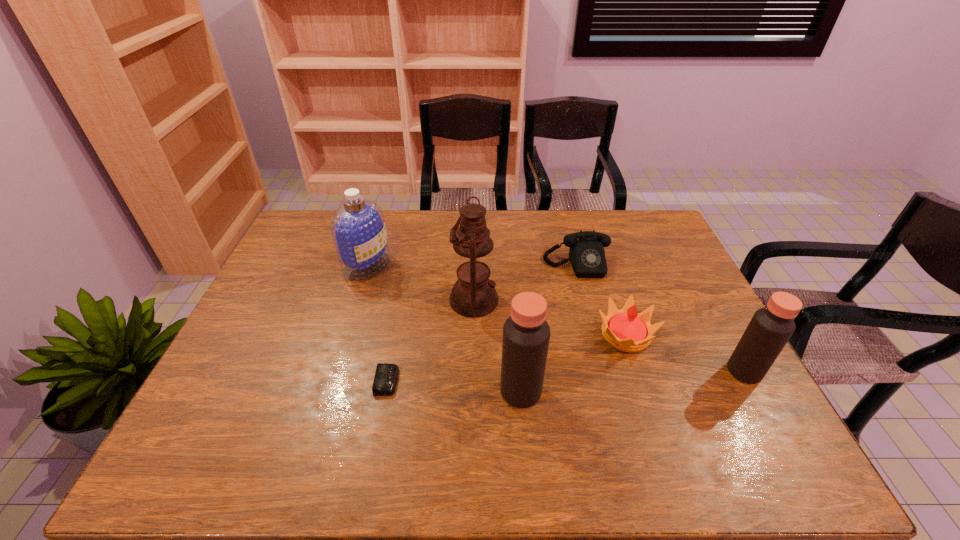
Select which object appears as the third closest to the sixth object from right to left. Please provide its 2D coordinates. Your answer should be formatted as a tuple, i.e. [(x, y)], where the tuple contains the x and y coordinates of a point satisfying the conditions above.

[(358, 229)]

This screenshot has height=540, width=960. What are the coordinates of `object that stands as the closest to the cleansing agent` in the screenshot? It's located at (473, 295).

The image size is (960, 540). I want to click on vacant area in the image that satisfies the following two spatial constraints: 1. on the front side of the oil lamp; 2. on the right side of the third shortest object, so click(473, 335).

Where is `vacant region that satisfies the following two spatial constraints: 1. on the dial of the second shortest object; 2. on the left side of the rightmost object`? Image resolution: width=960 pixels, height=540 pixels. vacant region that satisfies the following two spatial constraints: 1. on the dial of the second shortest object; 2. on the left side of the rightmost object is located at coordinates (605, 371).

At what (x,y) coordinates should I click in order to perform the action: click on vacant space that satisfies the following two spatial constraints: 1. on the front side of the cleansing agent; 2. on the left side of the shorter vinegar. Please return your answer as a coordinate pair (x, y). Image resolution: width=960 pixels, height=540 pixels. Looking at the image, I should click on (335, 371).